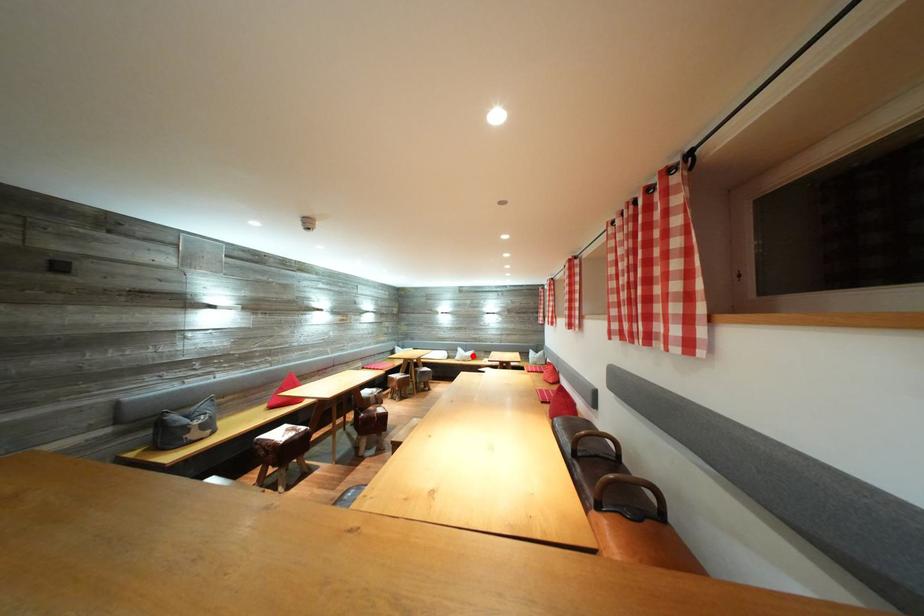
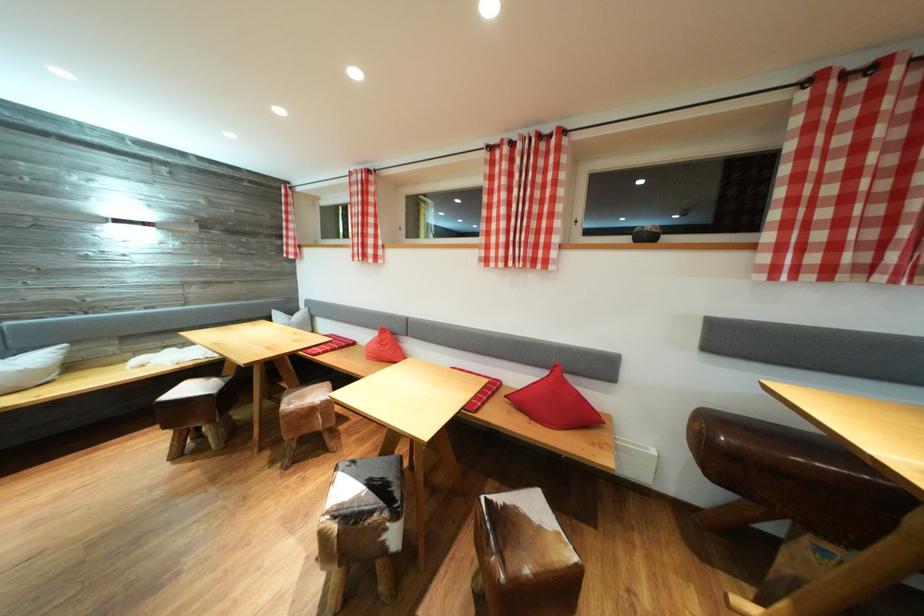
The point at the highlighted location is marked in the first image. Where is the corresponding point in the second image?

(14, 358)